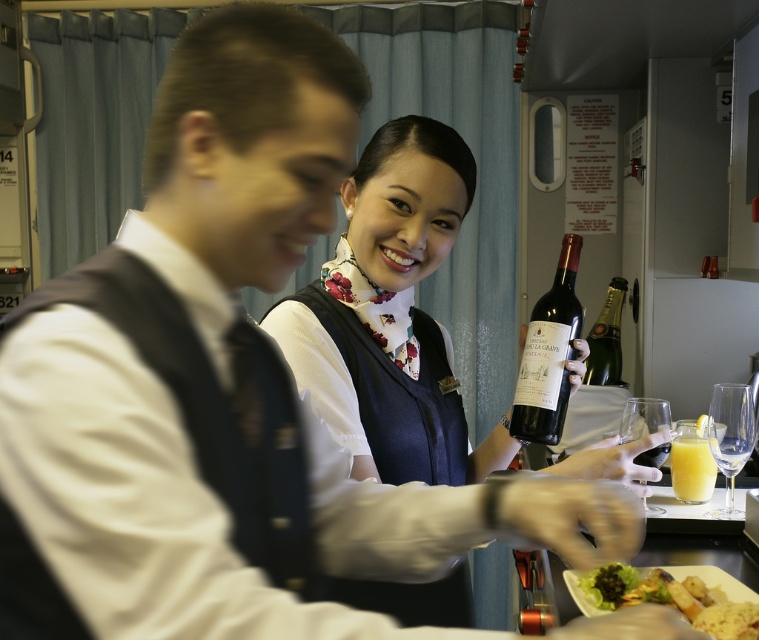
Which of these two, clear glass wine glass at lower right or matte glass champagne bottle at right, stands shorter?

clear glass wine glass at lower right is shorter.

Does clear glass wine glass at lower right have a greater height compared to matte glass champagne bottle at right?

No.

Which is behind, point (745, 387) or point (605, 332)?

The point (605, 332) is more distant.

Locate an element on the screen. clear glass wine glass at lower right is located at coordinates (729, 436).

Based on the photo, is matte blue vest at center positioned behind translucent glass at lower right?

No, it is in front of translucent glass at lower right.

Does matte blue vest at center have a greater width compared to translucent glass at lower right?

Yes.

Who is more distant from viewer, (361, 289) or (710, 458)?

Positioned behind is point (710, 458).

Where is `matte blue vest at center`? The image size is (759, 640). matte blue vest at center is located at coordinates (391, 316).

Can you confirm if matte blue vest at center is positioned to the right of green leafy salad at lower center?

No, matte blue vest at center is not to the right of green leafy salad at lower center.

Does matte blue vest at center have a lesser width compared to green leafy salad at lower center?

Incorrect, matte blue vest at center's width is not less than green leafy salad at lower center's.

Where is `matte blue vest at center`? The height and width of the screenshot is (640, 759). matte blue vest at center is located at coordinates (391, 316).

The height and width of the screenshot is (640, 759). In order to click on matte blue vest at center in this screenshot , I will do `click(391, 316)`.